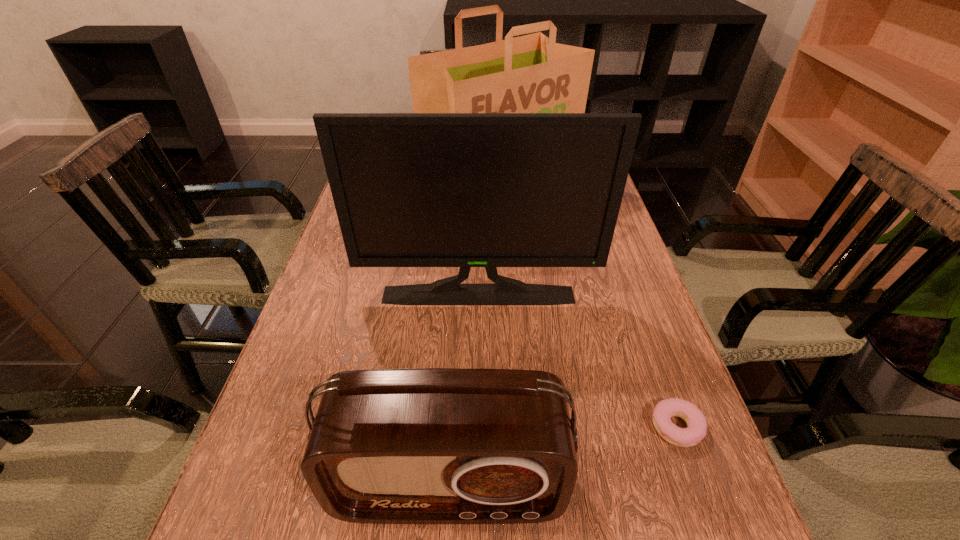
This screenshot has height=540, width=960. What are the coordinates of `grocery bag that is positioned at the right edge` in the screenshot? It's located at (527, 74).

Where is `monitor located in the right edge section of the desktop`? monitor located in the right edge section of the desktop is located at coordinates [465, 190].

Image resolution: width=960 pixels, height=540 pixels. I want to click on doughnut that is positioned at the right edge, so click(x=683, y=437).

In order to click on object located at the far right corner in this screenshot , I will do `click(527, 74)`.

In order to click on free space at the left edge of the desktop in this screenshot , I will do `click(355, 284)`.

This screenshot has width=960, height=540. Find the location of `vacant space at the right edge`. vacant space at the right edge is located at coordinates (616, 263).

At what (x,y) coordinates should I click in order to perform the action: click on free space between the farthest object and the second shortest object. Please return your answer as a coordinate pair (x, y). Looking at the image, I should click on point(473,337).

Identify the location of blank region between the radio receiver and the grocery bag. This screenshot has width=960, height=540. (473, 337).

I want to click on vacant space that is in between the farthest object and the third tallest object, so click(473, 337).

Identify which object is the third closest to the farthest object. Please provide its 2D coordinates. Your answer should be formatted as a tuple, i.e. [(x, y)], where the tuple contains the x and y coordinates of a point satisfying the conditions above.

[(433, 445)]